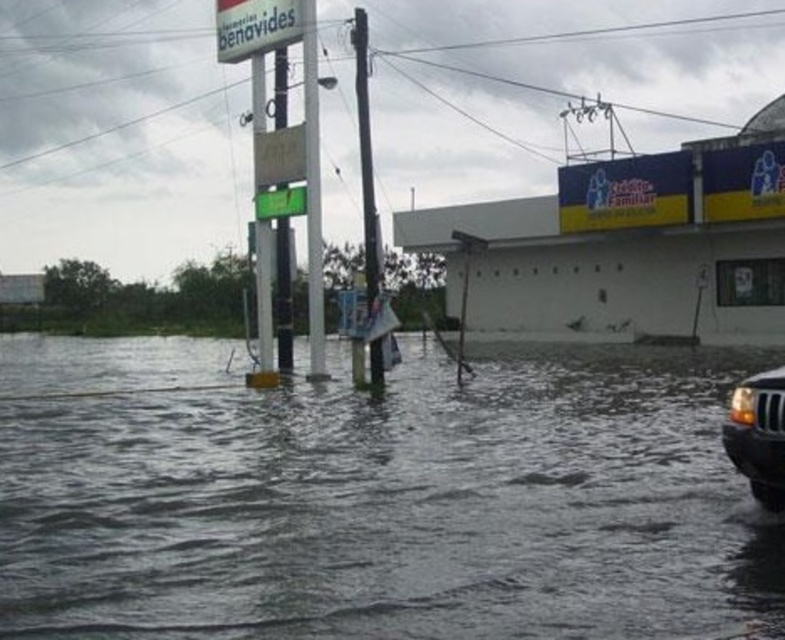
This screenshot has width=785, height=640. Identify the location of gray murky water at center. (367, 502).